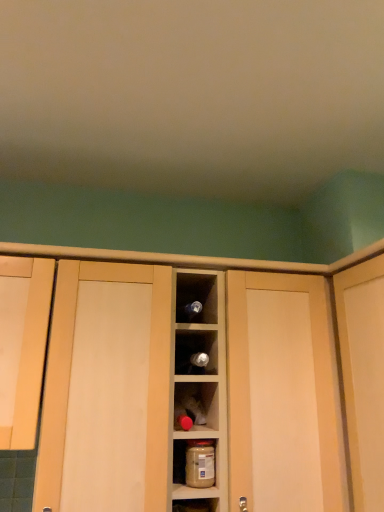
Find the location of a particular element. This screenshot has height=512, width=384. wooden cabinet at center, arranged as the first cabinetry when viewed from the right is located at coordinates (191, 258).

This screenshot has width=384, height=512. Describe the element at coordinates (22, 345) in the screenshot. I see `matte wood cabinet at left, which ranks as the 2th cabinetry in right-to-left order` at that location.

Identify the location of shiny silver wine bottle at center. This screenshot has height=512, width=384. (192, 364).

Describe the element at coordinates (194, 463) in the screenshot. I see `translucent plastic jar at center` at that location.

Find the location of a particular element. wooden cabinet at center, arranged as the first cabinetry when viewed from the right is located at coordinates (191, 258).

Is translucent plastic jar at center not close to wooden cabinet at center, arranged as the first cabinetry when viewed from the right?

They are positioned close to each other.

Is translucent plastic jar at center located outside wooden cabinet at center, the 2th cabinetry from the left?

No, translucent plastic jar at center is not entirely external to wooden cabinet at center, the 2th cabinetry from the left.

Is point (195, 481) behind point (381, 242)?

No, it is not.

From the image's perspective, which is below, translucent plastic jar at center or wooden cabinet at center, the 2th cabinetry from the left?

translucent plastic jar at center, from the image's perspective.

Is point (174, 256) farther from camera compared to point (184, 364)?

Yes, point (174, 256) is behind point (184, 364).

Is wooden cabinet at center, arranged as the first cabinetry when viewed from the right, aimed at shiny silver wine bottle at center?

Yes, wooden cabinet at center, arranged as the first cabinetry when viewed from the right, is oriented towards shiny silver wine bottle at center.

Considering their positions, is wooden cabinet at center, arranged as the first cabinetry when viewed from the right, located in front of or behind shiny silver wine bottle at center?

wooden cabinet at center, arranged as the first cabinetry when viewed from the right, is positioned closer to the viewer than shiny silver wine bottle at center.

Between matte wood door at right and translucent plastic jar at center, which one is positioned behind?

translucent plastic jar at center is further away from the camera.

Looking at the image, does matte wood door at right seem bigger or smaller compared to translucent plastic jar at center?

In the image, matte wood door at right appears to be larger than translucent plastic jar at center.

Is matte wood door at right oriented away from translucent plastic jar at center?

That's not correct — matte wood door at right is not looking away from translucent plastic jar at center.

Does translucent plastic jar at center turn towards matte wood cabinet at left, which ranks as the 2th cabinetry in right-to-left order?

No, translucent plastic jar at center is not turned towards matte wood cabinet at left, which ranks as the 2th cabinetry in right-to-left order.

Is point (178, 444) positioned before point (34, 313)?

No, (178, 444) is behind (34, 313).

Which of these two, translucent plastic jar at center or matte wood cabinet at left, which appears as the 1th cabinetry when viewed from the left, stands shorter?

Standing shorter between the two is translucent plastic jar at center.

Between translucent plastic jar at center and matte wood cabinet at left, which ranks as the 2th cabinetry in right-to-left order, which one is positioned in front?

matte wood cabinet at left, which ranks as the 2th cabinetry in right-to-left order, is more forward.

From the image's perspective, which one is positioned higher, wooden cabinet at center, the 2th cabinetry from the left, or translucent plastic jar at center?

wooden cabinet at center, the 2th cabinetry from the left, is shown above in the image.

Looking at their sizes, would you say wooden cabinet at center, the 2th cabinetry from the left, is wider or thinner than translucent plastic jar at center?

Considering their sizes, wooden cabinet at center, the 2th cabinetry from the left, looks broader than translucent plastic jar at center.

Considering the relative positions of wooden cabinet at center, arranged as the first cabinetry when viewed from the right, and translucent plastic jar at center in the image provided, is wooden cabinet at center, arranged as the first cabinetry when viewed from the right, to the left or to the right of translucent plastic jar at center?

wooden cabinet at center, arranged as the first cabinetry when viewed from the right, is to the left of translucent plastic jar at center.

Considering the sizes of objects wooden cabinet at center, the 2th cabinetry from the left, and translucent plastic jar at center in the image provided, who is taller, wooden cabinet at center, the 2th cabinetry from the left, or translucent plastic jar at center?

wooden cabinet at center, the 2th cabinetry from the left.

Looking at this image, in terms of width, does matte wood cabinet at left, which appears as the 1th cabinetry when viewed from the left, look wider or thinner when compared to wooden cabinet at center, arranged as the first cabinetry when viewed from the right?

Result: Considering their sizes, matte wood cabinet at left, which appears as the 1th cabinetry when viewed from the left, looks slimmer than wooden cabinet at center, arranged as the first cabinetry when viewed from the right.

From the image's perspective, between matte wood cabinet at left, which ranks as the 2th cabinetry in right-to-left order, and wooden cabinet at center, arranged as the first cabinetry when viewed from the right, which one is located above?

matte wood cabinet at left, which ranks as the 2th cabinetry in right-to-left order.

Between matte wood cabinet at left, which appears as the 1th cabinetry when viewed from the left, and wooden cabinet at center, arranged as the first cabinetry when viewed from the right, which one has larger size?

wooden cabinet at center, arranged as the first cabinetry when viewed from the right, is bigger.

Would you consider matte wood cabinet at left, which appears as the 1th cabinetry when viewed from the left, to be distant from wooden cabinet at center, arranged as the first cabinetry when viewed from the right?

No, there isn't a large distance between matte wood cabinet at left, which appears as the 1th cabinetry when viewed from the left, and wooden cabinet at center, arranged as the first cabinetry when viewed from the right.

Does shiny silver wine bottle at center turn towards matte wood cabinet at left, which appears as the 1th cabinetry when viewed from the left?

No, shiny silver wine bottle at center is not facing towards matte wood cabinet at left, which appears as the 1th cabinetry when viewed from the left.

Is shiny silver wine bottle at center in front of matte wood cabinet at left, which appears as the 1th cabinetry when viewed from the left?

No.

Identify the location of wine bottle that is under the matte wood cabinet at left, which ranks as the 2th cabinetry in right-to-left order (from a real-world perspective). The height and width of the screenshot is (512, 384). (192, 364).

The image size is (384, 512). What are the coordinates of `shelf behind the wooden cabinet at center, the 2th cabinetry from the left` in the screenshot? It's located at (194, 463).

Locate an element on the screen. cabinetry below the shiny silver wine bottle at center (from the image's perspective) is located at coordinates (191, 258).

Based on the photo, looking at the image, which one is located further to translucent plastic jar at center, shiny silver wine bottle at center or wooden cabinet at center, the 2th cabinetry from the left?

wooden cabinet at center, the 2th cabinetry from the left, is further to translucent plastic jar at center.

Estimate the real-world distances between objects in this image. Which object is closer to translucent plastic jar at center, matte wood cabinet at left, which ranks as the 2th cabinetry in right-to-left order, or shiny silver wine bottle at center?

The object closer to translucent plastic jar at center is shiny silver wine bottle at center.

Based on the photo, looking at the image, which one is located further to translucent plastic jar at center, wooden cabinet at center, arranged as the first cabinetry when viewed from the right, or matte wood cabinet at left, which appears as the 1th cabinetry when viewed from the left?

wooden cabinet at center, arranged as the first cabinetry when viewed from the right, is further to translucent plastic jar at center.

Considering their positions, is shiny silver wine bottle at center positioned closer to wooden cabinet at center, arranged as the first cabinetry when viewed from the right, than matte wood door at right?

The object closer to wooden cabinet at center, arranged as the first cabinetry when viewed from the right, is matte wood door at right.

Consider the image. Which object lies nearer to the anchor point matte wood door at right, shiny silver wine bottle at center or matte wood cabinet at left, which appears as the 1th cabinetry when viewed from the left?

shiny silver wine bottle at center.

Which object lies further to the anchor point matte wood cabinet at left, which ranks as the 2th cabinetry in right-to-left order, wooden cabinet at center, arranged as the first cabinetry when viewed from the right, or translucent plastic jar at center?

translucent plastic jar at center is further to matte wood cabinet at left, which ranks as the 2th cabinetry in right-to-left order.

Based on their spatial positions, is translucent plastic jar at center or matte wood door at right closer to matte wood cabinet at left, which ranks as the 2th cabinetry in right-to-left order?

translucent plastic jar at center lies closer to matte wood cabinet at left, which ranks as the 2th cabinetry in right-to-left order, than the other object.

Considering their positions, is shiny silver wine bottle at center positioned further to translucent plastic jar at center than matte wood door at right?

matte wood door at right lies further to translucent plastic jar at center than the other object.

This screenshot has height=512, width=384. I want to click on shelf located between wooden cabinet at center, the 2th cabinetry from the left, and matte wood door at right in the left-right direction, so click(x=194, y=463).

Where is `cabinetry between matte wood cabinet at left, which ranks as the 2th cabinetry in right-to-left order, and matte wood door at right, in the horizontal direction`? The image size is (384, 512). cabinetry between matte wood cabinet at left, which ranks as the 2th cabinetry in right-to-left order, and matte wood door at right, in the horizontal direction is located at coordinates (191, 258).

Where is `cabinetry between matte wood cabinet at left, which ranks as the 2th cabinetry in right-to-left order, and translucent plastic jar at center from left to right`? The width and height of the screenshot is (384, 512). cabinetry between matte wood cabinet at left, which ranks as the 2th cabinetry in right-to-left order, and translucent plastic jar at center from left to right is located at coordinates [x=191, y=258].

You are a GUI agent. You are given a task and a screenshot of the screen. Output one action in this format:
    pyautogui.click(x=<x>, y=<y>)
    Task: Click on the wine bottle between matte wood cabinet at left, which ranks as the 2th cabinetry in right-to-left order, and wooden cabinet at center, arranged as the first cabinetry when viewed from the right, from left to right
    This screenshot has width=384, height=512.
    Given the screenshot: What is the action you would take?
    pyautogui.click(x=192, y=364)